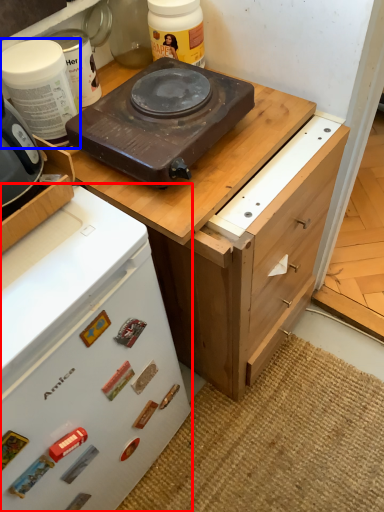
Question: Which point is further to the camera, home appliance (highlighted by a red box) or kitchen appliance (highlighted by a blue box)?

Choices:
 (A) home appliance
 (B) kitchen appliance

Answer: (B)